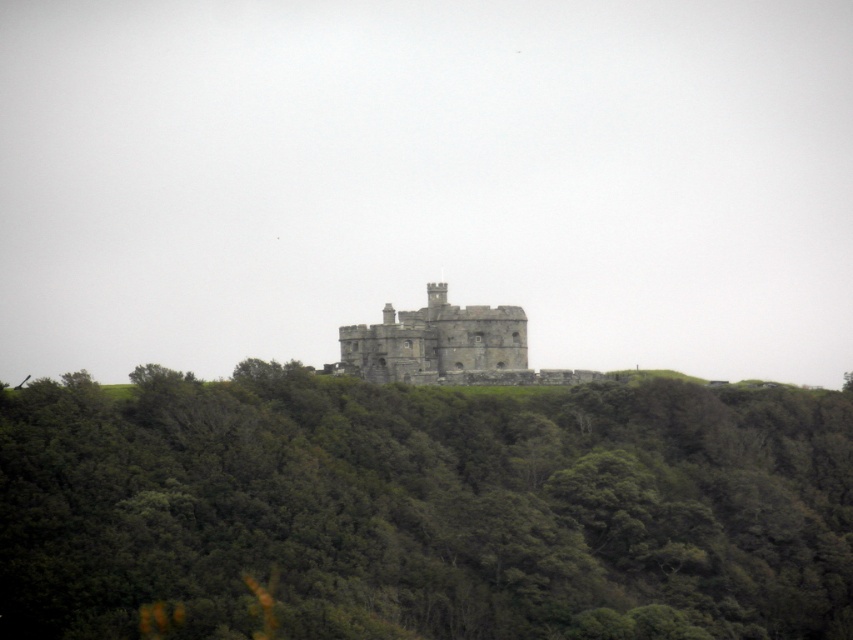
Looking at this image, you are a visitor approaching the castle and notice both the green leafy tree at center and the stone castle at center. Based on their positions, which one would you see first as you walk up the hill towards the castle?

The green leafy tree at center is located below the stone castle at center, so you would see the green leafy tree at center first as you approach the castle from the hill.

You are standing in front of the castle and want to take a photo of the castle without any trees blocking the view. Based on the scene description, which direction should you move to ensure the green leafy tree at center is no longer in the frame?

The green leafy tree at center is located at coordinates 0.792 on the x axis and 0.497 on the y axis. To remove it from the frame, move in the opposite direction of the tree. Since the tree is at the center, moving to the left or right would shift the view away from it. Alternatively, moving backward might reduce its prominence in the foreground.

You are a visitor standing in front of the green leafy tree at center and the stone castle at center. Which object is bigger in size?

The green leafy tree at center has a larger size compared to the stone castle at center, so the green leafy tree at center is bigger.